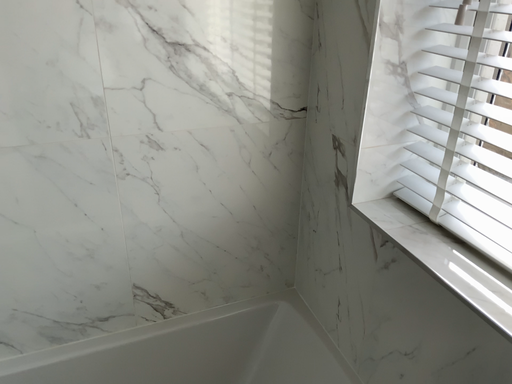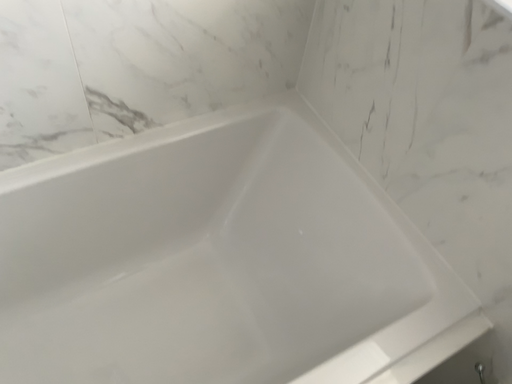
Question: How did the camera likely rotate when shooting the video?

Choices:
 (A) rotated upward
 (B) rotated downward

Answer: (B)